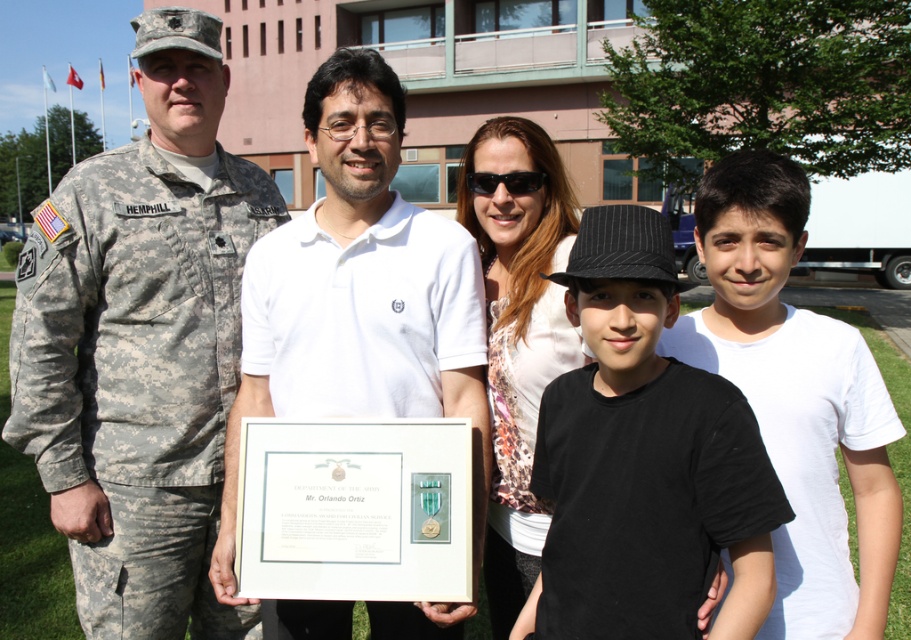
Question: Based on their relative distances, which object is farther from the white printed shirt at center?

Choices:
 (A) white matte shirt at center
 (B) black matte hat at center
 (C) white cotton shirt at right
 (D) camouflage uniform at left

Answer: (D)

Question: Does white matte shirt at center have a greater width compared to white cotton shirt at right?

Choices:
 (A) no
 (B) yes

Answer: (B)

Question: Is white matte shirt at center above white printed shirt at center?

Choices:
 (A) yes
 (B) no

Answer: (A)

Question: Does black matte hat at center appear on the left side of white cotton shirt at right?

Choices:
 (A) no
 (B) yes

Answer: (B)

Question: Which of the following is the farthest from the observer?

Choices:
 (A) camouflage uniform at left
 (B) white printed shirt at center
 (C) black matte hat at center
 (D) white cotton shirt at right

Answer: (A)

Question: Which of these objects is positioned closest to the white cotton shirt at right?

Choices:
 (A) camouflage uniform at left
 (B) white matte shirt at center
 (C) black matte hat at center

Answer: (C)